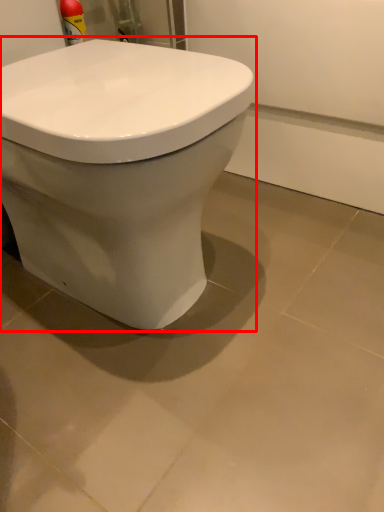
Question: Observing the image, what is the correct spatial positioning of toilet (annotated by the red box) in reference to ceramic tile?

Choices:
 (A) left
 (B) right

Answer: (A)